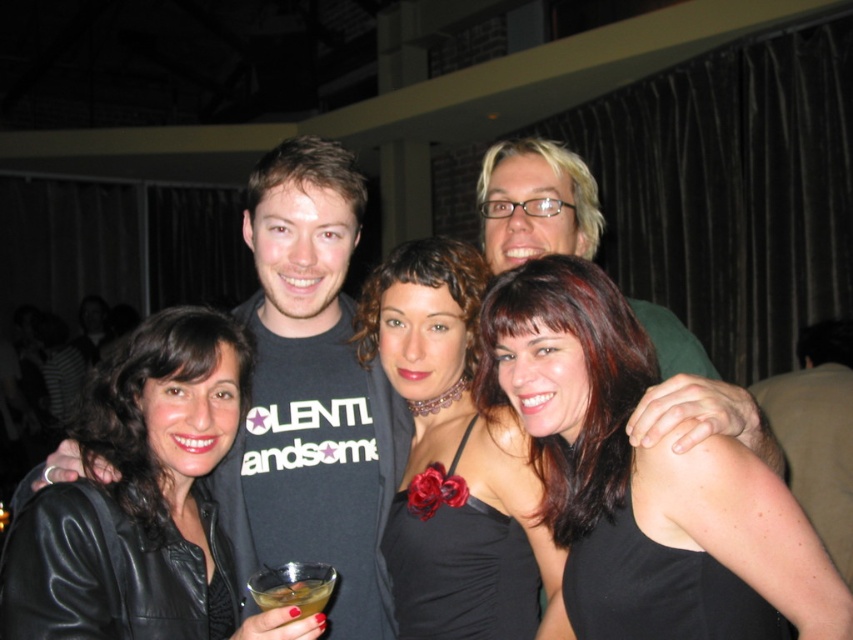
Question: Can you confirm if leather jacket at left is smaller than translucent glass drink at lower left?

Choices:
 (A) yes
 (B) no

Answer: (B)

Question: Does black satin dress at center have a greater width compared to blonde hair at upper right?

Choices:
 (A) yes
 (B) no

Answer: (B)

Question: Which of the following is the closest to the observer?

Choices:
 (A) pyautogui.click(x=316, y=584)
 (B) pyautogui.click(x=735, y=541)

Answer: (B)

Question: Which of these objects is positioned farthest from the shiny black dress at center?

Choices:
 (A) translucent glass drink at lower left
 (B) leather jacket at left

Answer: (B)

Question: Which of the following is the closest to the observer?

Choices:
 (A) black satin dress at center
 (B) leather jacket at left

Answer: (B)

Question: Considering the relative positions of shiny black dress at center and leather jacket at left in the image provided, where is shiny black dress at center located with respect to leather jacket at left?

Choices:
 (A) above
 (B) below

Answer: (A)